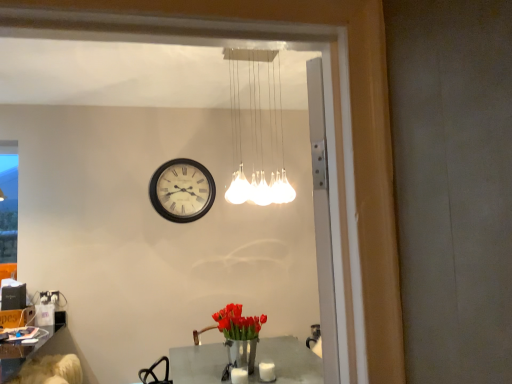
Question: Is shiny metallic vase with red tulips at center shorter than light brown leather swivel chair at lower left?

Choices:
 (A) no
 (B) yes

Answer: (A)

Question: Considering the relative sizes of shiny metallic vase with red tulips at center and light brown leather swivel chair at lower left in the image provided, is shiny metallic vase with red tulips at center smaller than light brown leather swivel chair at lower left?

Choices:
 (A) yes
 (B) no

Answer: (A)

Question: Is shiny metallic vase with red tulips at center positioned beyond the bounds of light brown leather swivel chair at lower left?

Choices:
 (A) no
 (B) yes

Answer: (B)

Question: Is shiny metallic vase with red tulips at center not near light brown leather swivel chair at lower left?

Choices:
 (A) no
 (B) yes

Answer: (B)

Question: Could you tell me if shiny metallic vase with red tulips at center is turned towards light brown leather swivel chair at lower left?

Choices:
 (A) yes
 (B) no

Answer: (B)

Question: Considering the relative sizes of shiny metallic vase with red tulips at center and light brown leather swivel chair at lower left in the image provided, is shiny metallic vase with red tulips at center bigger than light brown leather swivel chair at lower left?

Choices:
 (A) no
 (B) yes

Answer: (A)

Question: From the image's perspective, does white glass pendant lights at upper center appear lower than white matte candle at lower center, the first candle from the right?

Choices:
 (A) no
 (B) yes

Answer: (A)

Question: Can you confirm if white glass pendant lights at upper center is positioned to the right of white matte candle at lower center, placed as the second candle when sorted from left to right?

Choices:
 (A) no
 (B) yes

Answer: (A)

Question: From the image's perspective, is white glass pendant lights at upper center on white matte candle at lower center, placed as the second candle when sorted from left to right?

Choices:
 (A) yes
 (B) no

Answer: (A)

Question: Is white glass pendant lights at upper center located outside white matte candle at lower center, the first candle from the right?

Choices:
 (A) no
 (B) yes

Answer: (B)

Question: Would you say white glass pendant lights at upper center is a long distance from white matte candle at lower center, the first candle from the right?

Choices:
 (A) no
 (B) yes

Answer: (B)

Question: Is white glass pendant lights at upper center further to camera compared to white matte candle at lower center, placed as the second candle when sorted from left to right?

Choices:
 (A) yes
 (B) no

Answer: (B)

Question: Is matte black clock at center smaller than white glass pendant lights at upper center?

Choices:
 (A) yes
 (B) no

Answer: (A)